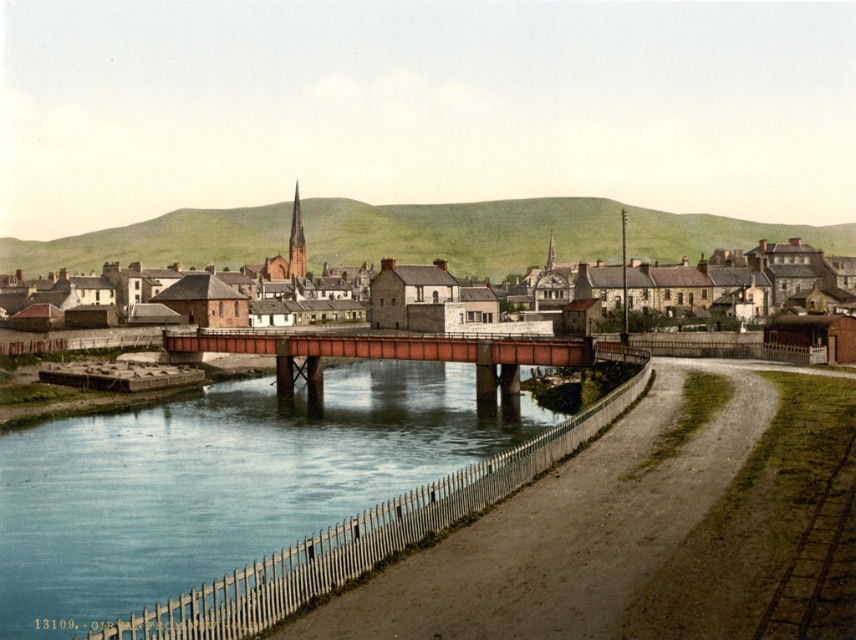
Which is above, blue smooth water at center or rusty metal bridge at center?

rusty metal bridge at center is higher up.

Measure the distance between point (247, 428) and camera.

They are 60.17 meters apart.

Where is `blue smooth water at center`? The height and width of the screenshot is (640, 856). blue smooth water at center is located at coordinates (218, 483).

Image resolution: width=856 pixels, height=640 pixels. What do you see at coordinates (218, 483) in the screenshot? I see `blue smooth water at center` at bounding box center [218, 483].

Does blue smooth water at center appear over brown brick bridge at center?

No, blue smooth water at center is not above brown brick bridge at center.

Is point (33, 557) closer to viewer compared to point (539, 246)?

Yes.

Locate an element on the screen. This screenshot has height=640, width=856. blue smooth water at center is located at coordinates (218, 483).

Does brown brick bridge at center have a lesser height compared to rusty metal bridge at center?

No.

Is brown brick bridge at center closer to camera compared to rusty metal bridge at center?

No.

Does point (88, 243) lie in front of point (317, 348)?

No, it is behind (317, 348).

At what (x,y) coordinates should I click in order to perform the action: click on brown brick bridge at center. Please return your answer as a coordinate pair (x, y). This screenshot has width=856, height=640. Looking at the image, I should click on pyautogui.click(x=462, y=232).